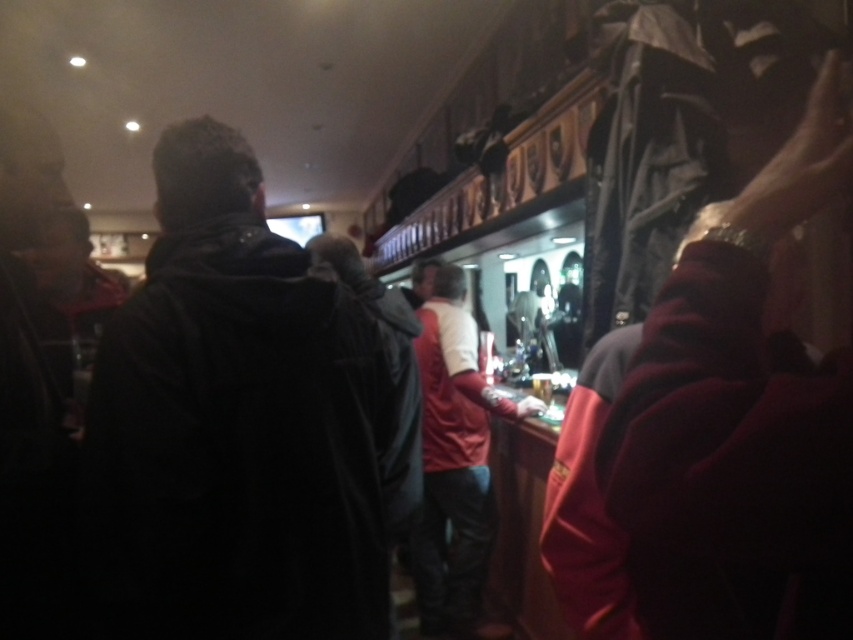
Question: Which of these objects is positioned closest to the red leather jacket at center?

Choices:
 (A) dark fabric jacket at center
 (B) dark red sweater at right

Answer: (A)

Question: Does dark fabric jacket at center lie in front of red leather jacket at center?

Choices:
 (A) no
 (B) yes

Answer: (B)

Question: Does dark fabric jacket at center have a smaller size compared to dark red sweater at right?

Choices:
 (A) no
 (B) yes

Answer: (A)

Question: Among these points, which one is nearest to the camera?

Choices:
 (A) (183, 196)
 (B) (434, 560)

Answer: (A)

Question: Which point is farther to the camera?

Choices:
 (A) click(97, 515)
 (B) click(726, 460)

Answer: (A)

Question: Does dark fabric jacket at center lie in front of dark red sweater at right?

Choices:
 (A) no
 (B) yes

Answer: (A)